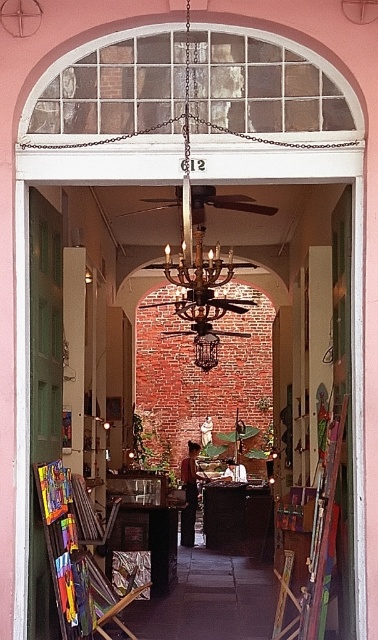
Question: In this image, where is wooden easel at left located relative to bronze textured chandelier at center?

Choices:
 (A) above
 (B) below

Answer: (B)

Question: From the image, what is the correct spatial relationship of wooden easel at left in relation to bronze textured chandelier at center?

Choices:
 (A) below
 (B) above

Answer: (A)

Question: Among these objects, which one is nearest to the camera?

Choices:
 (A) wooden easel at left
 (B) bronze textured chandelier at center

Answer: (B)

Question: Which point is closer to the camera?

Choices:
 (A) wooden easel at left
 (B) bronze textured chandelier at center

Answer: (B)

Question: Observing the image, what is the correct spatial positioning of wooden easel at left in reference to bronze textured chandelier at center?

Choices:
 (A) left
 (B) right

Answer: (A)